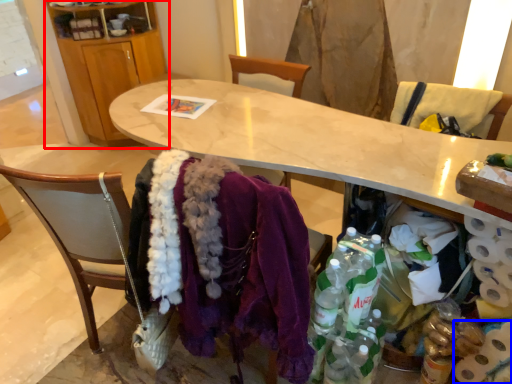
Question: Which object appears closest to the camera in this image, cabinetry (highlighted by a red box) or toilet paper (highlighted by a blue box)?

Choices:
 (A) cabinetry
 (B) toilet paper

Answer: (B)